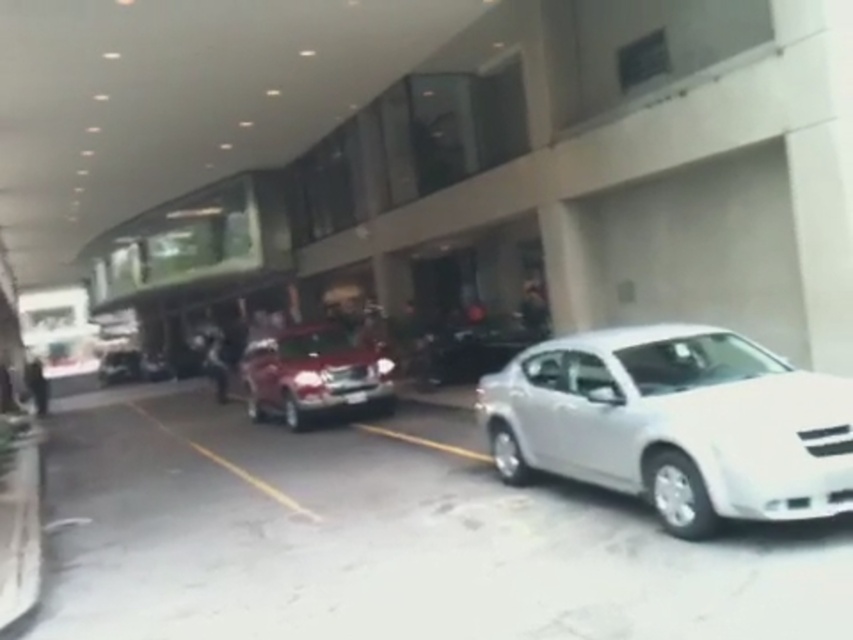
You are standing at the point marked by the coordinates (312, 372) in the parking area. Looking around, you see a shiny red car at center and a white sedan on the right. Which vehicle are you closer to?

You are standing at the point marked by the coordinates (312, 372), which corresponds to the shiny red car at center. Therefore, you are closer to the shiny red car at center.

You are a delivery person who needs to park your van between the shiny red car at center and the shiny silver sedan at center. Your van is 2.2 meters wide. Can you fit your van between them?

The shiny red car at center is wider than the shiny silver sedan at center. However, the exact distance between them isn